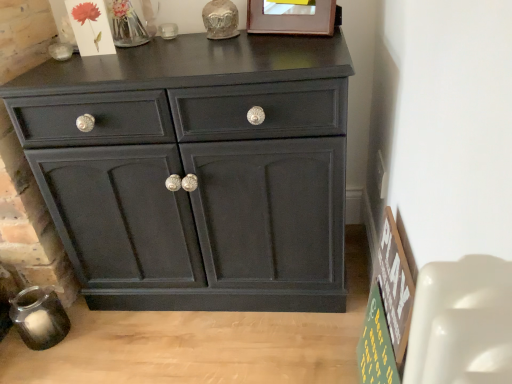
Question: Can you confirm if wooden picture frame at upper center is taller than green wooden signboard at lower right?

Choices:
 (A) no
 (B) yes

Answer: (A)

Question: From a real-world perspective, is wooden picture frame at upper center physically below green wooden signboard at lower right?

Choices:
 (A) yes
 (B) no

Answer: (B)

Question: Is wooden picture frame at upper center turned away from green wooden signboard at lower right?

Choices:
 (A) yes
 (B) no

Answer: (B)

Question: Is wooden picture frame at upper center behind green wooden signboard at lower right?

Choices:
 (A) no
 (B) yes

Answer: (B)

Question: Is wooden picture frame at upper center facing towards green wooden signboard at lower right?

Choices:
 (A) yes
 (B) no

Answer: (B)

Question: Is wooden picture frame at upper center bigger than green wooden signboard at lower right?

Choices:
 (A) no
 (B) yes

Answer: (A)

Question: Can you confirm if matte black cabinet at center is shorter than green wooden signboard at lower right?

Choices:
 (A) yes
 (B) no

Answer: (B)

Question: From the image's perspective, is matte black cabinet at center under green wooden signboard at lower right?

Choices:
 (A) yes
 (B) no

Answer: (B)

Question: Is matte black cabinet at center to the left of green wooden signboard at lower right from the viewer's perspective?

Choices:
 (A) yes
 (B) no

Answer: (A)

Question: Can you confirm if matte black cabinet at center is smaller than green wooden signboard at lower right?

Choices:
 (A) no
 (B) yes

Answer: (A)

Question: Is matte black cabinet at center bigger than green wooden signboard at lower right?

Choices:
 (A) no
 (B) yes

Answer: (B)

Question: From the image's perspective, is matte black cabinet at center above green wooden signboard at lower right?

Choices:
 (A) no
 (B) yes

Answer: (B)

Question: Is wooden picture frame at upper center at the right side of matte black cabinet at center?

Choices:
 (A) yes
 (B) no

Answer: (A)